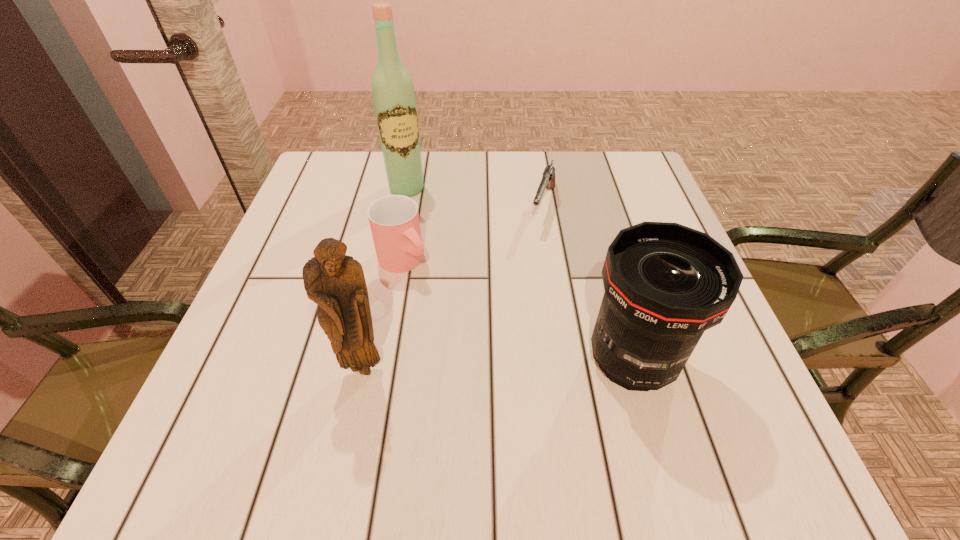
At what (x,y) coordinates should I click in order to perform the action: click on free space located 0.170m on the side of the third farthest object with the handle. Please return your answer as a coordinate pair (x, y). Looking at the image, I should click on (468, 329).

In order to click on free space located 0.340m on the side of the third farthest object with the handle in this screenshot , I will do `click(532, 394)`.

Where is `vacant area situated 0.240m on the side of the third farthest object with the handle`? This screenshot has width=960, height=540. vacant area situated 0.240m on the side of the third farthest object with the handle is located at coordinates (492, 354).

Identify the location of vacant region located aiming along the barrel of the gun. The image size is (960, 540). pos(518,298).

Locate an element on the screen. The height and width of the screenshot is (540, 960). vacant space located 0.090m aiming along the barrel of the gun is located at coordinates (533, 258).

Locate an element on the screen. This screenshot has height=540, width=960. free space located 0.310m aiming along the barrel of the gun is located at coordinates (505, 336).

At what (x,y) coordinates should I click in order to perform the action: click on wine bottle that is at the far edge. Please return your answer as a coordinate pair (x, y). The width and height of the screenshot is (960, 540). Looking at the image, I should click on (393, 92).

Image resolution: width=960 pixels, height=540 pixels. In order to click on gun that is positioned at the far edge in this screenshot , I will do `click(548, 179)`.

Find the location of `figurine present at the near edge`. figurine present at the near edge is located at coordinates (336, 282).

The height and width of the screenshot is (540, 960). What are the coordinates of `telephoto lens positioned at the near edge` in the screenshot? It's located at (665, 284).